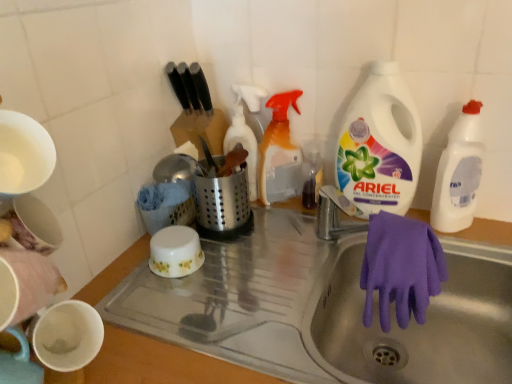
Question: Could you tell me if translucent plastic spray bottle at upper center, positioned as the first cleaning product in left-to-right order, is facing purple rubber glove at sink?

Choices:
 (A) no
 (B) yes

Answer: (A)

Question: Can you confirm if translucent plastic spray bottle at upper center, positioned as the first cleaning product in left-to-right order, is bigger than purple rubber glove at sink?

Choices:
 (A) no
 (B) yes

Answer: (A)

Question: From the image's perspective, is translucent plastic spray bottle at upper center, which ranks as the fourth cleaning product in right-to-left order, on purple rubber glove at sink?

Choices:
 (A) no
 (B) yes

Answer: (B)

Question: Is translucent plastic spray bottle at upper center, positioned as the first cleaning product in left-to-right order, looking in the opposite direction of purple rubber glove at sink?

Choices:
 (A) yes
 (B) no

Answer: (B)

Question: Is translucent plastic spray bottle at upper center, positioned as the first cleaning product in left-to-right order, taller than purple rubber glove at sink?

Choices:
 (A) no
 (B) yes

Answer: (B)

Question: Looking at the image, does translucent plastic spray bottle at upper center, which ranks as the fourth cleaning product in right-to-left order, seem bigger or smaller compared to white plastic bottle at upper right, the second cleaning product viewed from the right?

Choices:
 (A) small
 (B) big

Answer: (A)

Question: Would you say translucent plastic spray bottle at upper center, which ranks as the fourth cleaning product in right-to-left order, is to the left or to the right of white plastic bottle at upper right, arranged as the 3th cleaning product when viewed from the left, in the picture?

Choices:
 (A) right
 (B) left

Answer: (B)

Question: In terms of width, does translucent plastic spray bottle at upper center, which ranks as the fourth cleaning product in right-to-left order, look wider or thinner when compared to white plastic bottle at upper right, the second cleaning product viewed from the right?

Choices:
 (A) wide
 (B) thin

Answer: (B)

Question: Is point (240, 125) closer or farther from the camera than point (380, 107)?

Choices:
 (A) closer
 (B) farther

Answer: (B)

Question: In the image, is white plastic bottle at upper right, the second cleaning product viewed from the right, positioned in front of or behind translucent plastic spray bottle at upper center, positioned as the first cleaning product in left-to-right order?

Choices:
 (A) front
 (B) behind

Answer: (A)

Question: Is point (345, 168) positioned closer to the camera than point (246, 124)?

Choices:
 (A) closer
 (B) farther

Answer: (A)

Question: From a real-world perspective, is white plastic bottle at upper right, arranged as the 3th cleaning product when viewed from the left, physically located above or below translucent plastic spray bottle at upper center, positioned as the first cleaning product in left-to-right order?

Choices:
 (A) below
 (B) above

Answer: (B)

Question: In terms of size, does white plastic bottle at upper right, arranged as the 3th cleaning product when viewed from the left, appear bigger or smaller than translucent plastic spray bottle at upper center, which ranks as the fourth cleaning product in right-to-left order?

Choices:
 (A) small
 (B) big

Answer: (B)

Question: From a real-world perspective, relative to purple rubber glove at lower right, is white plastic bottle at upper right, which is counted as the 1th cleaning product, starting from the right, vertically above or below?

Choices:
 (A) below
 (B) above

Answer: (B)

Question: Is white plastic bottle at upper right, which is the fourth cleaning product from left to right, spatially inside purple rubber glove at lower right, or outside of it?

Choices:
 (A) outside
 (B) inside

Answer: (A)